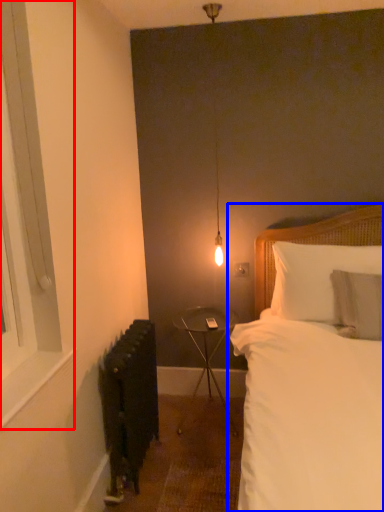
Question: Which object appears farthest to the camera in this image, window (highlighted by a red box) or bed (highlighted by a blue box)?

Choices:
 (A) window
 (B) bed

Answer: (A)